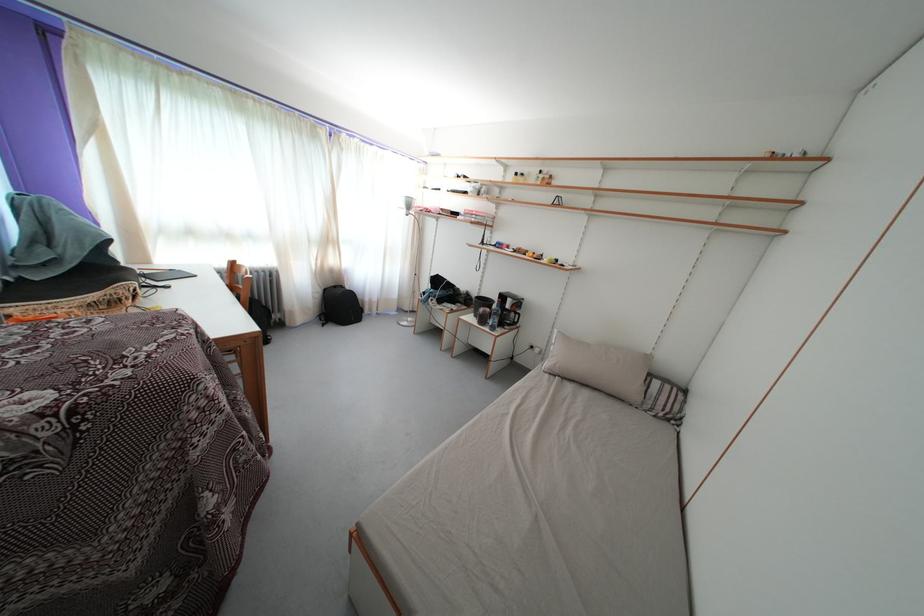
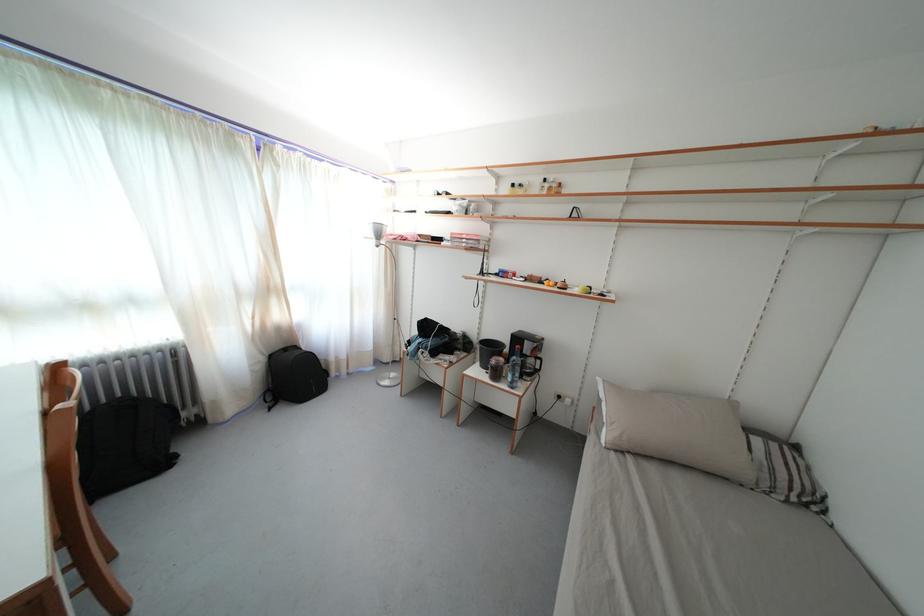
In the second image, find the point that corresponds to point 523,180 in the first image.

(518, 191)